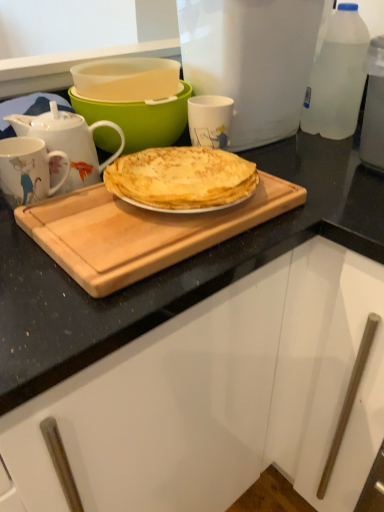
Question: Does white glossy mug at upper center, arranged as the second coffee cup when ordered from the bottom, contain porcelain floral mug at left, which ranks as the 1th coffee cup in left-to-right order?

Choices:
 (A) no
 (B) yes

Answer: (A)

Question: Is white glossy mug at upper center, which appears as the second coffee cup when viewed from the left, positioned in front of porcelain floral mug at left, positioned as the first coffee cup in front-to-back order?

Choices:
 (A) yes
 (B) no

Answer: (B)

Question: Does white glossy mug at upper center, the first coffee cup in the top-to-bottom sequence, have a smaller size compared to porcelain floral mug at left, the second coffee cup when ordered from back to front?

Choices:
 (A) no
 (B) yes

Answer: (B)

Question: Does white glossy mug at upper center, the 2th coffee cup in the front-to-back sequence, appear on the right side of porcelain floral mug at left, marked as the 1th coffee cup in a bottom-to-top arrangement?

Choices:
 (A) no
 (B) yes

Answer: (B)

Question: Is white glossy mug at upper center, the first coffee cup in the top-to-bottom sequence, further to the viewer compared to porcelain floral mug at left, the second coffee cup when ordered from back to front?

Choices:
 (A) no
 (B) yes

Answer: (B)

Question: Can you confirm if white glossy mug at upper center, the first coffee cup in the top-to-bottom sequence, is wider than porcelain floral mug at left, the second coffee cup from the right?

Choices:
 (A) yes
 (B) no

Answer: (B)

Question: From a real-world perspective, is white plastic container at upper center physically above wooden cutting board at center?

Choices:
 (A) yes
 (B) no

Answer: (A)

Question: Is white plastic container at upper center wider than wooden cutting board at center?

Choices:
 (A) yes
 (B) no

Answer: (A)

Question: Is white plastic container at upper center not inside wooden cutting board at center?

Choices:
 (A) yes
 (B) no

Answer: (A)

Question: Can you confirm if white plastic container at upper center is taller than wooden cutting board at center?

Choices:
 (A) no
 (B) yes

Answer: (B)

Question: Does white plastic container at upper center come in front of wooden cutting board at center?

Choices:
 (A) no
 (B) yes

Answer: (A)

Question: Considering the relative sizes of white plastic container at upper center and wooden cutting board at center in the image provided, is white plastic container at upper center bigger than wooden cutting board at center?

Choices:
 (A) yes
 (B) no

Answer: (A)

Question: Is porcelain floral mug at left, the second coffee cup when ordered from back to front, located outside clear plastic bottle at upper right?

Choices:
 (A) no
 (B) yes

Answer: (B)